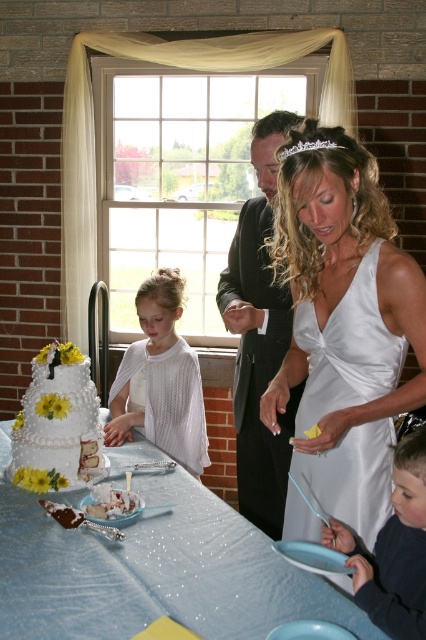
What are the coordinates of the black satin suit at center in the image?

The black satin suit at center is located at coordinates point (259, 337).

Based on the scene description, which object is bigger between the black satin suit at center and the white textured cake at center?

The black satin suit at center is larger in size than the white textured cake at center.